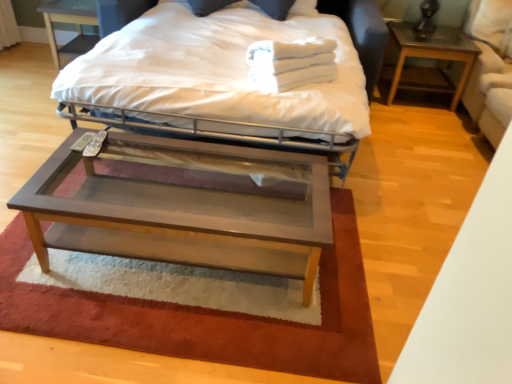
Question: Is white cotton towels at upper center inside or outside of white fabric swivel chair at right?

Choices:
 (A) outside
 (B) inside

Answer: (A)

Question: Is point (331, 67) closer or farther from the camera than point (502, 109)?

Choices:
 (A) farther
 (B) closer

Answer: (B)

Question: Based on their relative distances, which object is farther from the white cotton towels at upper center?

Choices:
 (A) dark wood nightstand at upper left, which ranks as the 1th nightstand in left-to-right order
 (B) brown wood nightstand at right, the first nightstand from the right
 (C) wooden glass coffee table at center
 (D) matte white bed at center
 (E) white fabric swivel chair at right

Answer: (A)

Question: Which is farther from the wooden glass coffee table at center?

Choices:
 (A) dark wood nightstand at upper left, which ranks as the 1th nightstand in left-to-right order
 (B) matte white bed at center
 (C) brown plush rug at center
 (D) brown wood nightstand at right, the first nightstand from the right
 (E) white cotton towels at upper center

Answer: (D)